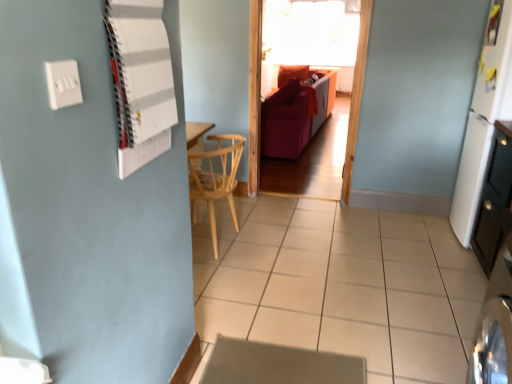
You are a GUI agent. You are given a task and a screenshot of the screen. Output one action in this format:
    pyautogui.click(x=<x>, y=<y>)
    Task: Click on the free space underneath natural wood chair at center (from a real-world perspective)
    Image resolution: width=512 pixels, height=384 pixels.
    Given the screenshot: What is the action you would take?
    pyautogui.click(x=232, y=242)